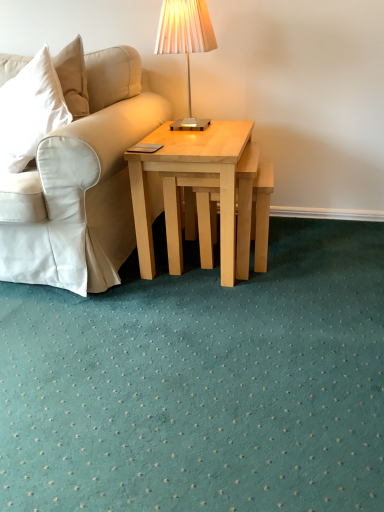
This screenshot has width=384, height=512. I want to click on metallic silver table lamp at upper center, so click(185, 42).

Between natural wood coffee table at center and metallic silver table lamp at upper center, which one has less height?

metallic silver table lamp at upper center is shorter.

From a real-world perspective, who is located lower, natural wood coffee table at center or metallic silver table lamp at upper center?

In real-world perspective, natural wood coffee table at center is lower.

Does natural wood coffee table at center appear on the left side of metallic silver table lamp at upper center?

No.

Is natural wood coffee table at center wider or thinner than metallic silver table lamp at upper center?

natural wood coffee table at center is wider than metallic silver table lamp at upper center.

In the scene shown: Which is more to the left, light wood stool at center or natural wood coffee table at center?

From the viewer's perspective, natural wood coffee table at center appears more on the left side.

Does point (257, 192) lie in front of point (149, 221)?

That is False.

Considering the relative sizes of light wood stool at center and natural wood coffee table at center in the image provided, is light wood stool at center thinner than natural wood coffee table at center?

Correct, the width of light wood stool at center is less than that of natural wood coffee table at center.

From a real-world perspective, between light wood stool at center and natural wood coffee table at center, who is vertically higher?

natural wood coffee table at center, from a real-world perspective.

How many degrees apart are the facing directions of natural wood coffee table at center and light wood stool at center?

3.46 degrees.

Which object is positioned more to the left, natural wood coffee table at center or light wood stool at center?

natural wood coffee table at center.

Based on the photo, from the image's perspective, is natural wood coffee table at center located above light wood stool at center?

Yes, from the image's perspective, natural wood coffee table at center is over light wood stool at center.

From a real-world perspective, is natural wood coffee table at center positioned over light wood stool at center based on gravity?

Yes, from a real-world perspective, natural wood coffee table at center is above light wood stool at center.

From the image's perspective, relative to light wood stool at center, is metallic silver table lamp at upper center above or below?

metallic silver table lamp at upper center is above light wood stool at center.

Does metallic silver table lamp at upper center have a greater width compared to light wood stool at center?

No.

Who is shorter, metallic silver table lamp at upper center or light wood stool at center?

light wood stool at center.

Is metallic silver table lamp at upper center next to light wood stool at center and touching it?

No, metallic silver table lamp at upper center is not making contact with light wood stool at center.

Is light wood stool at center surrounding metallic silver table lamp at upper center?

No, metallic silver table lamp at upper center is not surrounded by light wood stool at center.

How many degrees apart are the facing directions of light wood stool at center and metallic silver table lamp at upper center?

light wood stool at center and metallic silver table lamp at upper center are facing 3.46 degrees away from each other.

Is light wood stool at center oriented away from metallic silver table lamp at upper center?

No, light wood stool at center is not facing away from metallic silver table lamp at upper center.

Which is less distant, (255, 232) or (167, 29)?

Point (255, 232) is positioned farther from the camera compared to point (167, 29).

Which is nearer, (194, 40) or (221, 178)?

The point (221, 178) is in front.

Based on the photo, who is shorter, metallic silver table lamp at upper center or natural wood coffee table at center?

Standing shorter between the two is metallic silver table lamp at upper center.

How much distance is there between metallic silver table lamp at upper center and natural wood coffee table at center?

They are 18.57 inches apart.

Is metallic silver table lamp at upper center facing away from natural wood coffee table at center?

No, metallic silver table lamp at upper center is not facing away from natural wood coffee table at center.

I want to click on table lamp located above the natural wood coffee table at center (from the image's perspective), so click(x=185, y=42).

The height and width of the screenshot is (512, 384). I want to click on coffee table on the left of the light wood stool at center, so click(190, 172).

Consider the image. Based on their spatial positions, is light wood stool at center or metallic silver table lamp at upper center closer to natural wood coffee table at center?

light wood stool at center lies closer to natural wood coffee table at center than the other object.

Based on their spatial positions, is metallic silver table lamp at upper center or natural wood coffee table at center closer to light wood stool at center?

natural wood coffee table at center is positioned closer to the anchor light wood stool at center.

Estimate the real-world distances between objects in this image. Which object is closer to light wood stool at center, natural wood coffee table at center or metallic silver table lamp at upper center?

natural wood coffee table at center is closer to light wood stool at center.

Based on their spatial positions, is light wood stool at center or natural wood coffee table at center closer to metallic silver table lamp at upper center?

The object closer to metallic silver table lamp at upper center is natural wood coffee table at center.

Based on their spatial positions, is natural wood coffee table at center or light wood stool at center closer to metallic silver table lamp at upper center?

The object closer to metallic silver table lamp at upper center is natural wood coffee table at center.

Which object lies nearer to the anchor point natural wood coffee table at center, metallic silver table lamp at upper center or light wood stool at center?

light wood stool at center lies closer to natural wood coffee table at center than the other object.

Locate an element on the screen. coffee table between metallic silver table lamp at upper center and light wood stool at center in the up-down direction is located at coordinates (190, 172).